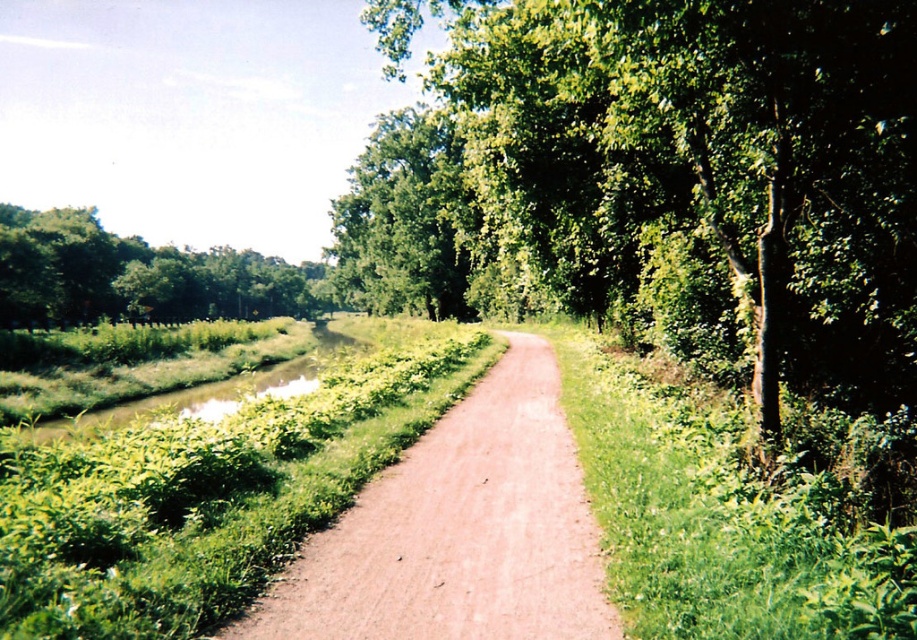
How distant is dirt path at center from green grassy bank at center?

25.25 meters

Is the position of dirt path at center more distant than that of green grassy bank at center?

No.

Who is more forward, [597,612] or [166,401]?

Point [597,612] is more forward.

The width and height of the screenshot is (917, 640). What are the coordinates of `dirt path at center` in the screenshot? It's located at (458, 531).

Locate an element on the screen. green leafy tree at upper left is located at coordinates (137, 276).

Between point (201, 289) and point (204, 356), which one is positioned in front?

Point (204, 356) is more forward.

This screenshot has width=917, height=640. Find the location of `green leafy tree at upper left`. green leafy tree at upper left is located at coordinates (137, 276).

Is point (862, 237) closer to viewer compared to point (18, 300)?

Yes, point (862, 237) is closer to viewer.

Identify the location of green leafy tree at center. (698, 172).